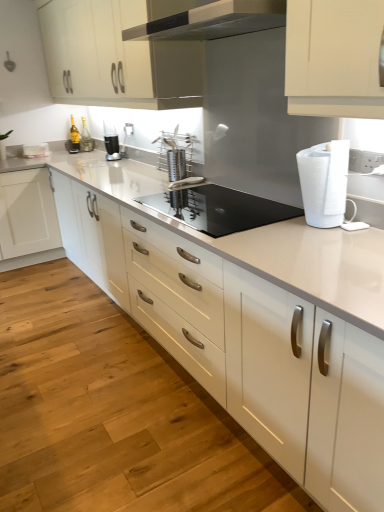
Question: Would you say white plastic paper towel at right is to the left or to the right of white glossy countertop at center in the picture?

Choices:
 (A) right
 (B) left

Answer: (A)

Question: From the image's perspective, is white plastic paper towel at right above or below white glossy countertop at center?

Choices:
 (A) below
 (B) above

Answer: (B)

Question: Considering the real-world distances, which object is farthest from the black plastic blender at center?

Choices:
 (A) black glass cooktop at center, which is the 2th appliance in top-to-bottom order
 (B) satin silver utensil holder at center, the second appliance from the front
 (C) white glossy countertop at center
 (D) white plastic paper towel at right
 (E) matte white cabinets at upper center

Answer: (D)

Question: Based on their relative distances, which object is farther from the black glass cooktop at center, the 1th appliance from the front?

Choices:
 (A) black plastic blender at center
 (B) satin silver utensil holder at center, the second appliance from the front
 (C) matte white cabinets at upper center
 (D) white plastic paper towel at right
 (E) white glossy countertop at center

Answer: (A)